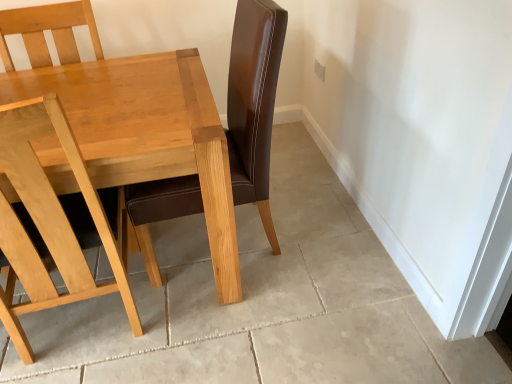
Question: From a real-world perspective, is light wood chair at left on top of light wood table at center?

Choices:
 (A) yes
 (B) no

Answer: (A)

Question: Considering the relative sizes of light wood chair at left and light wood table at center in the image provided, is light wood chair at left taller than light wood table at center?

Choices:
 (A) yes
 (B) no

Answer: (A)

Question: From a real-world perspective, is light wood chair at left physically below light wood table at center?

Choices:
 (A) no
 (B) yes

Answer: (A)

Question: From the image's perspective, would you say light wood chair at left is positioned over light wood table at center?

Choices:
 (A) yes
 (B) no

Answer: (B)

Question: Can you see light wood chair at left touching light wood table at center?

Choices:
 (A) yes
 (B) no

Answer: (B)

Question: Considering the relative positions of light wood chair at left and light wood table at center in the image provided, is light wood chair at left to the right of light wood table at center from the viewer's perspective?

Choices:
 (A) yes
 (B) no

Answer: (A)

Question: Considering the relative sizes of light wood table at center and light wood chair at left in the image provided, is light wood table at center bigger than light wood chair at left?

Choices:
 (A) yes
 (B) no

Answer: (A)

Question: Does light wood table at center have a smaller size compared to light wood chair at left?

Choices:
 (A) no
 (B) yes

Answer: (A)

Question: From a real-world perspective, is light wood table at center under light wood chair at left?

Choices:
 (A) no
 (B) yes

Answer: (B)

Question: Can you confirm if light wood table at center is thinner than light wood chair at left?

Choices:
 (A) yes
 (B) no

Answer: (B)

Question: Can you confirm if light wood table at center is positioned to the left of light wood chair at left?

Choices:
 (A) no
 (B) yes

Answer: (B)

Question: From the image's perspective, is light wood table at center located beneath light wood chair at left?

Choices:
 (A) yes
 (B) no

Answer: (B)

Question: In terms of size, does light wood table at center appear bigger or smaller than light wood chair at left?

Choices:
 (A) small
 (B) big

Answer: (B)